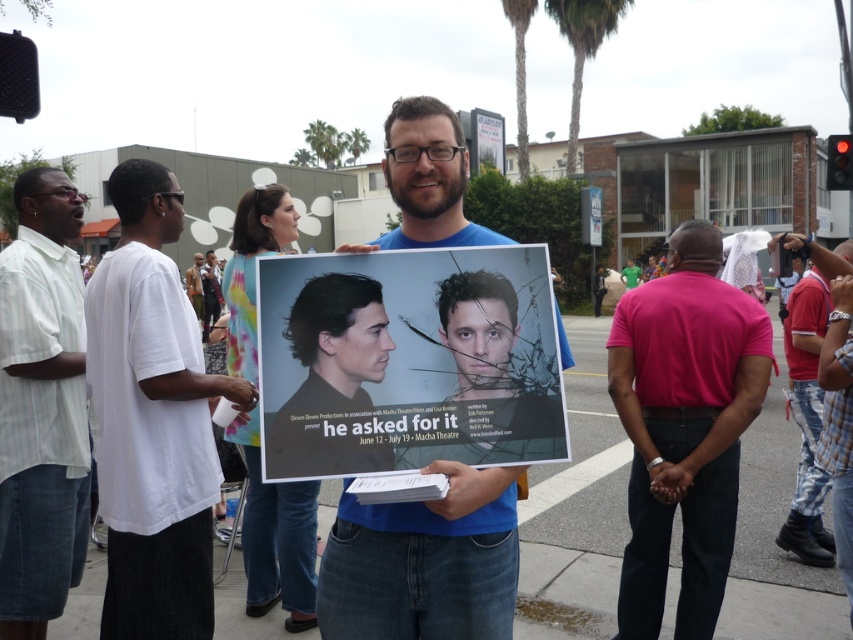
Question: Is white striped shirt at left thinner than green fabric shirt at center?

Choices:
 (A) yes
 (B) no

Answer: (A)

Question: Can you confirm if pink cotton shirt at center is bigger than white striped shirt at left?

Choices:
 (A) no
 (B) yes

Answer: (B)

Question: Considering the real-world distances, which object is closest to the white striped shirt at left?

Choices:
 (A) blue cotton shirt at center
 (B) green fabric shirt at center
 (C) white cotton t-shirt at left
 (D) plaid denim pants at lower right

Answer: (C)

Question: Where is white striped shirt at left located in relation to plaid denim pants at lower right in the image?

Choices:
 (A) right
 (B) left

Answer: (B)

Question: Which of the following is the closest to the observer?

Choices:
 (A) (405, 412)
 (B) (674, 451)
 (C) (107, 332)

Answer: (A)

Question: Which object is positioned farthest from the blue cotton shirt at center?

Choices:
 (A) white striped shirt at left
 (B) pink cotton shirt at center

Answer: (A)